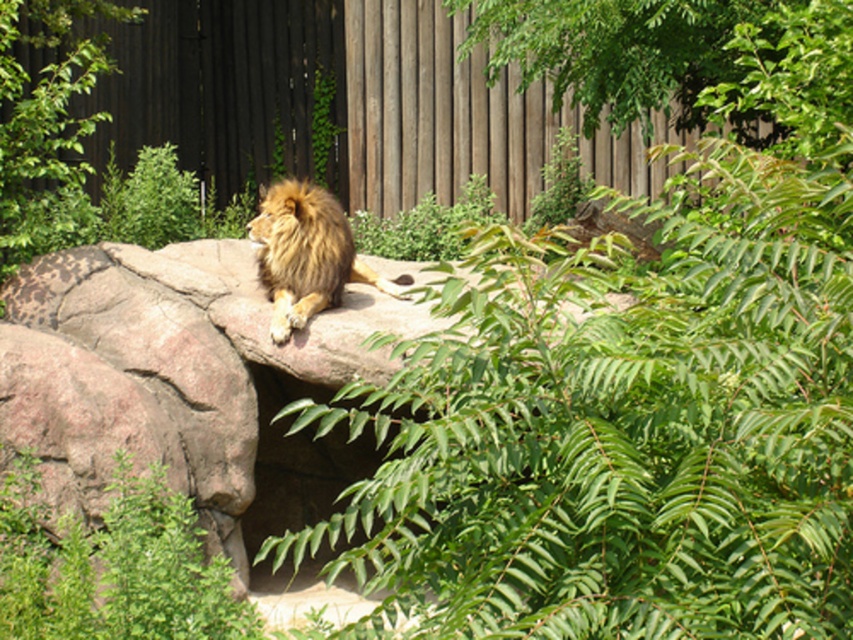
Question: Is brown rough rock at center positioned before golden fur lion at center?

Choices:
 (A) yes
 (B) no

Answer: (A)

Question: Is brown rough rock at center below golden fur lion at center?

Choices:
 (A) no
 (B) yes

Answer: (B)

Question: Which of the following is the closest to the observer?

Choices:
 (A) brown rough rock at center
 (B) golden fur lion at center

Answer: (A)

Question: Observing the image, what is the correct spatial positioning of brown rough rock at center in reference to golden fur lion at center?

Choices:
 (A) below
 (B) above

Answer: (A)